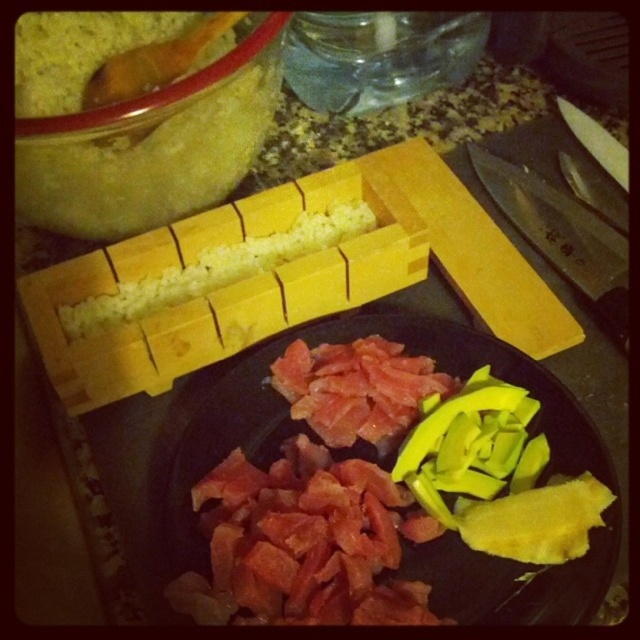
You are a sushi chef preparing a roll and need to grab the avocado and rice. Given that your hands can reach 10 inches, can you reach both the yellow smooth avocado at lower right and the yellow rice at center without moving your hands?

The yellow smooth avocado at lower right and the yellow rice at center are 9.74 inches apart. Since your hands can reach 10 inches, you can reach both without moving your hands.